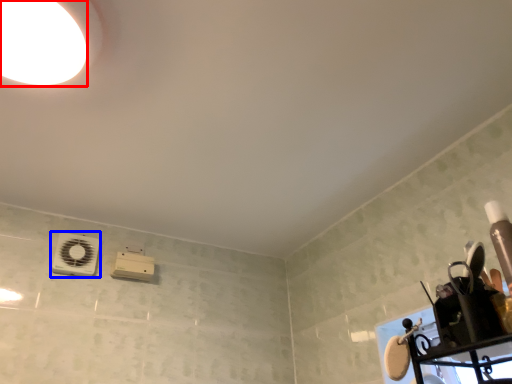
Question: Which point is closer to the camera, droplight (highlighted by a red box) or appliance (highlighted by a blue box)?

Choices:
 (A) droplight
 (B) appliance

Answer: (A)